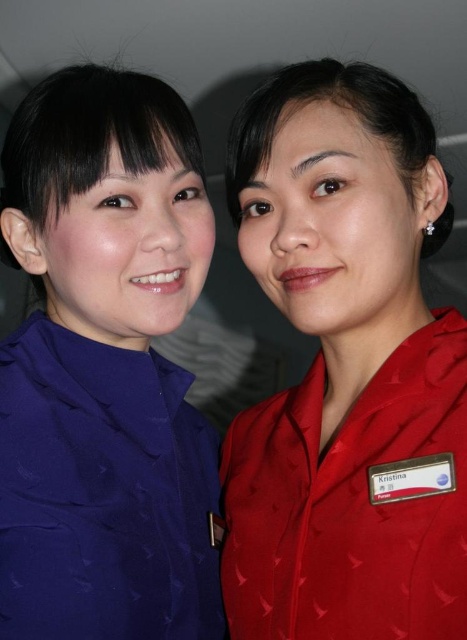
You are a passenger on an airplane and need to ask a question to the flight attendant. You see the matte red uniform at right and the matte blue shirt at left. Which one should you approach first if you want to ask the person who is closer to you?

The matte red uniform at right is in front of the matte blue shirt at left, so the matte red uniform at right is closer to you. Approach the matte red uniform at right first.

Looking at this image, you are a flight attendant who needs to determine if both uniforms can fit side by side on a 1.2 meter wide shelf. The matte red uniform at right is wider than the matte blue shirt at left. What is the maximum combined width of both uniforms?

The combined width of the matte red uniform at right and the matte blue shirt at left would be the sum of their individual widths. However, since the matte red uniform at right is wider than the matte blue shirt at left, and the shelf is 1.2 meters wide, the maximum combined width they can occupy without exceeding the shelf space is 1.2 meters.

You are a passenger on an airplane and you see two staff members, the matte red uniform at right and the matte blue shirt at left. Which staff member is shorter?

The matte red uniform at right is not as tall as the matte blue shirt at left, so the staff member in the matte red uniform at right is shorter.